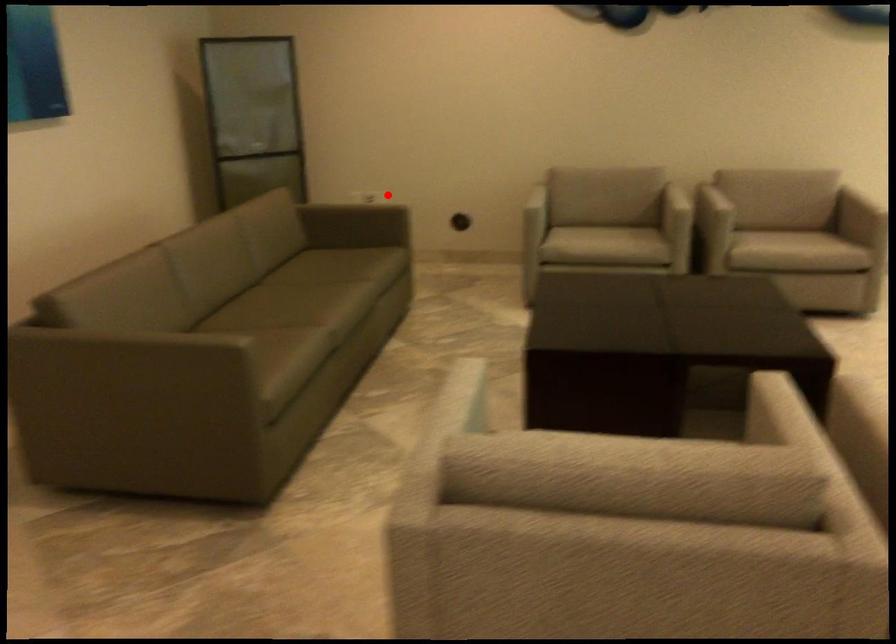
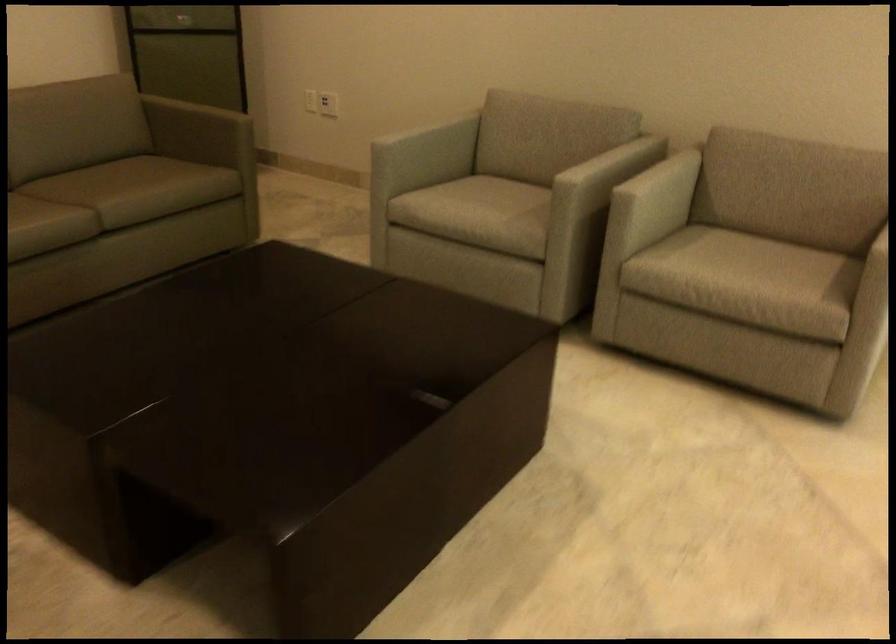
Question: I am providing you with two images of the same scene from different viewpoints. In image1, a red point is highlighted. Considering the same 3D point in image2, which of the following is correct?

Choices:
 (A) It is closer
 (B) It is farther

Answer: (A)